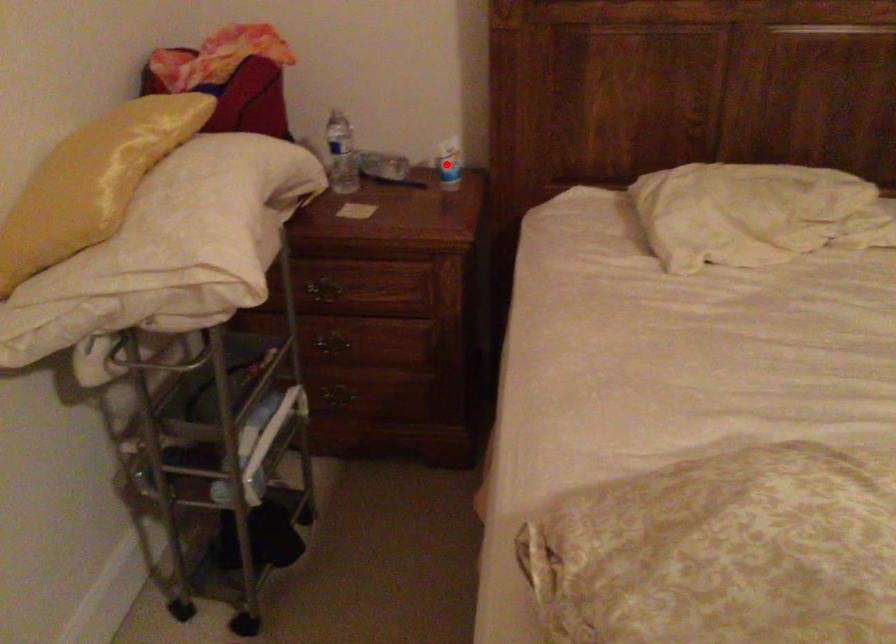
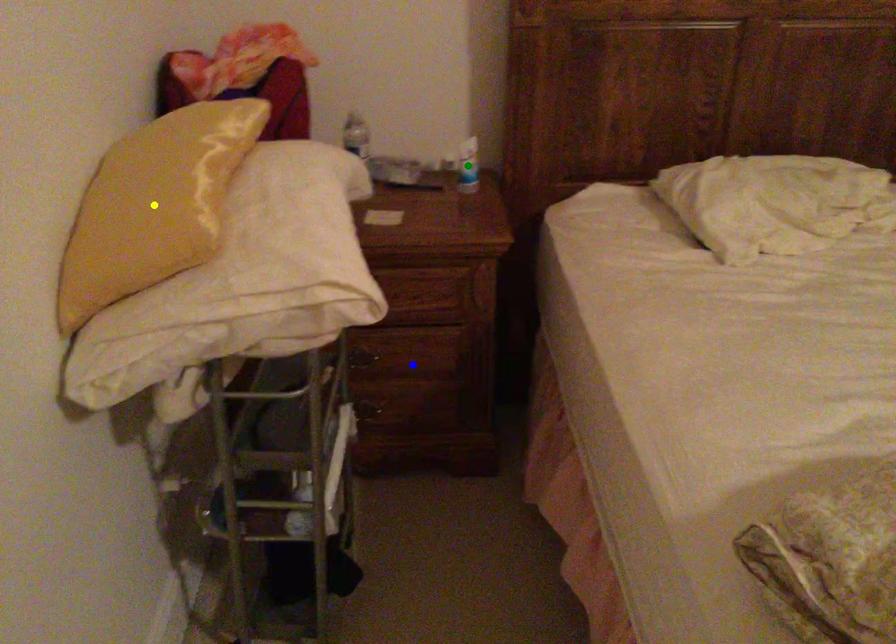
Question: I am providing you with two images of the same scene from different viewpoints. A red point is marked on the first image. You are given multiple points on the second image. Which spot in image 2 lines up with the point in image 1?

Choices:
 (A) yellow point
 (B) blue point
 (C) green point

Answer: (C)